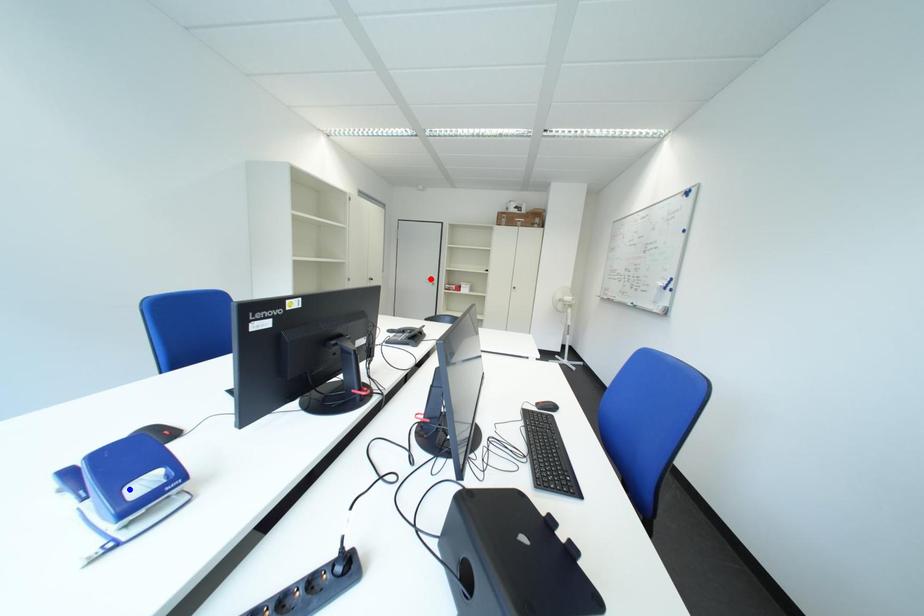
Question: Two points are marked on the image. Which point is closer to the camera?

Choices:
 (A) Blue point is closer.
 (B) Red point is closer.

Answer: (A)